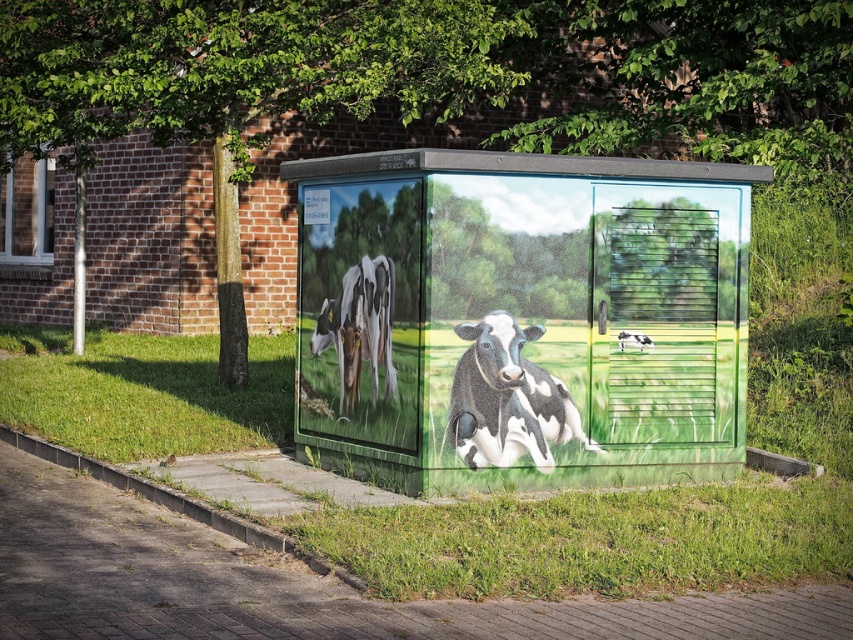
You are standing in front of the utility box and notice two points marked on its surface. The first point is at coordinates point (376, 221) and the second is at point (625, 333). Which point is closer to you?

Point (376, 221) is closer to the viewer than point (625, 333).

You are standing at the point (699, 381) and want to reach the utility box. The utility box is 8.80 meters away from your current position. If you walk straight towards it, will you reach it before the utility box?

Yes, because the distance between you and the utility box is 8.80 meters, so walking straight towards it will allow you to reach it before the utility box.